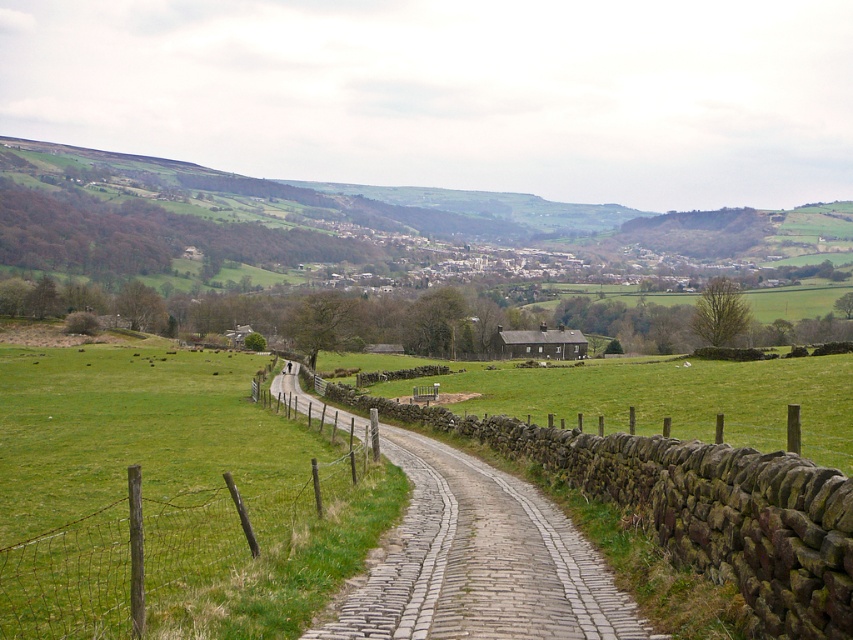
Based on the photo, you are standing at the starting point of the cobblestone path at center. Which direction should you walk to reach the cluster of buildings in the midground?

Since the cobblestone path at center is located at point [480,561], you should walk forward along the path towards the midground where the cluster of buildings is situated.

You are standing at the point labeled as point [480,561] in the image. What is the name of the feature you are currently standing on?

You are standing on the cobblestone path at center, which is located at point [480,561].

You are a hiker who wants to know which object in the image is shorter between the cobblestone path at center and the wire mesh fence at lower left. Can you help determine this?

The cobblestone path at center is shorter than the wire mesh fence at lower left according to the description.